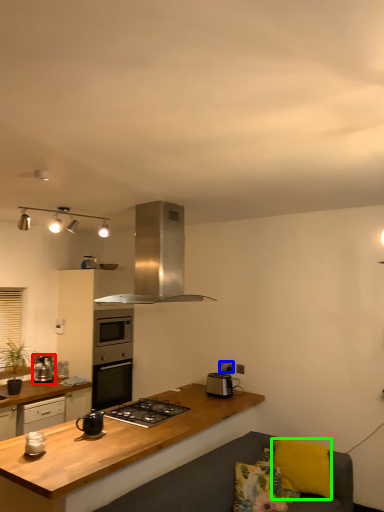
Question: Estimate the real-world distances between objects in this image. Which object is closer to kitchen appliance (highlighted by a red box), electric outlet (highlighted by a blue box) or pillow (highlighted by a green box)?

Choices:
 (A) electric outlet
 (B) pillow

Answer: (A)